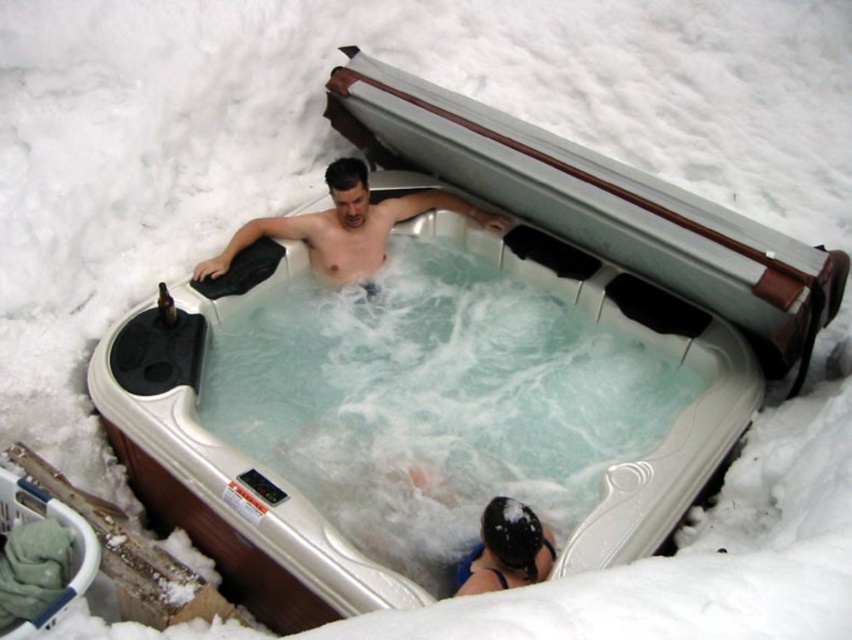
Describe the element at coordinates (435, 400) in the screenshot. The height and width of the screenshot is (640, 852). I see `clear plastic water at center` at that location.

Which is behind, point (352, 352) or point (496, 224)?

The point (496, 224) is more distant.

Locate an element on the screen. Image resolution: width=852 pixels, height=640 pixels. clear plastic water at center is located at coordinates [x=435, y=400].